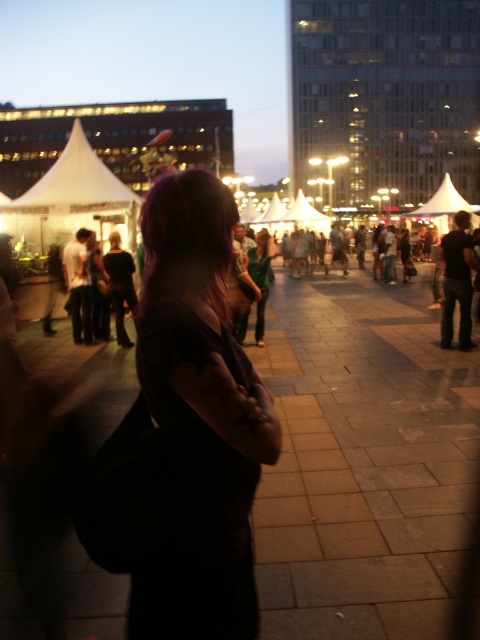
Which is in front, point (210, 468) or point (112, 209)?

Point (210, 468) is in front.

Is point (212, 196) behind point (82, 186)?

No.

What do you see at coordinates (200, 416) in the screenshot? I see `matte black dress at center` at bounding box center [200, 416].

This screenshot has width=480, height=640. In order to click on matte black dress at center in this screenshot , I will do `click(200, 416)`.